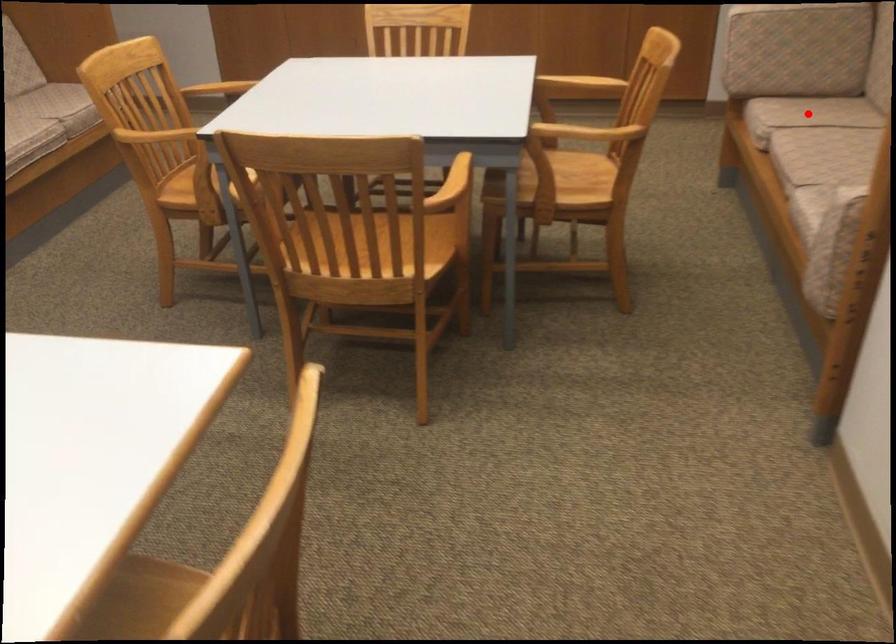
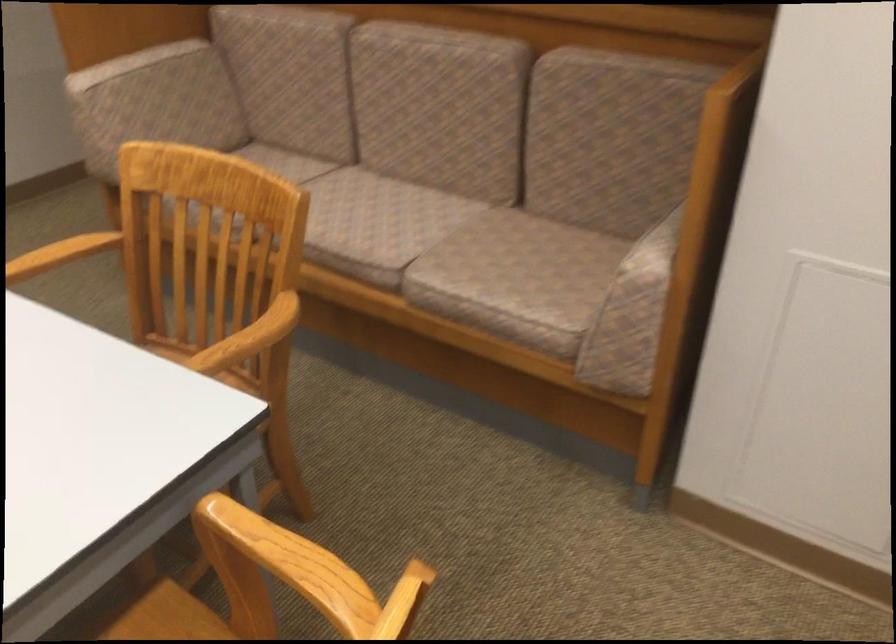
Question: I am providing you with two images of the same scene from different viewpoints. A red point is marked on the first image. Can you still see the location of the red point in image 2?

Choices:
 (A) Yes
 (B) No

Answer: (B)